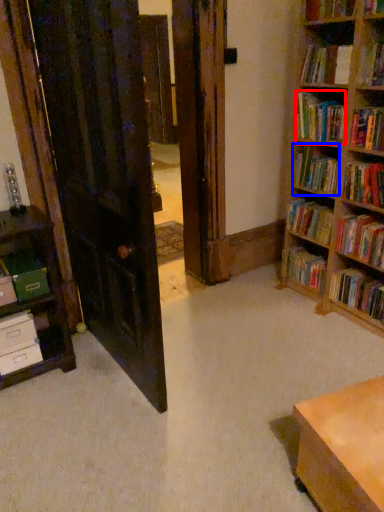
Question: Which point is closer to the camera, book (highlighted by a red box) or book (highlighted by a blue box)?

Choices:
 (A) book
 (B) book

Answer: (A)